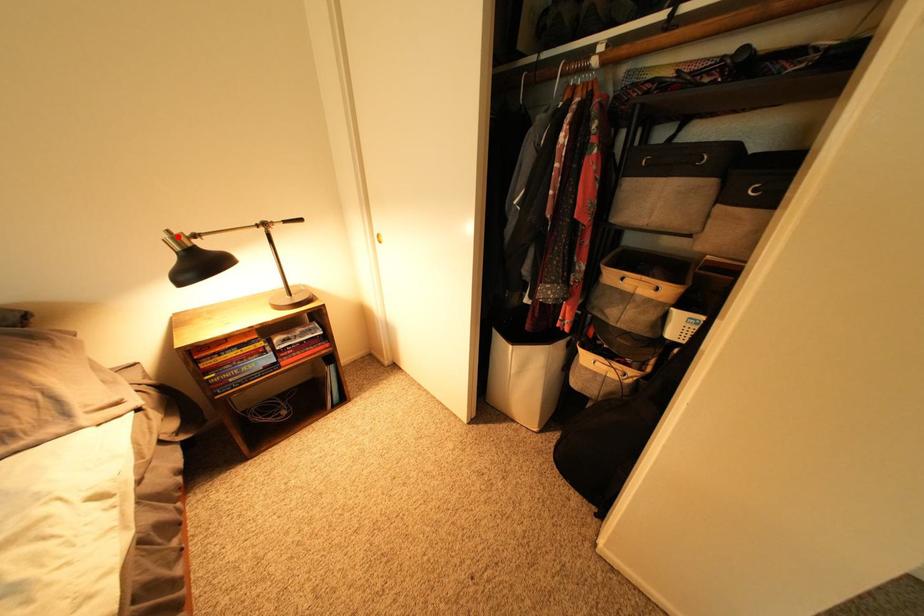
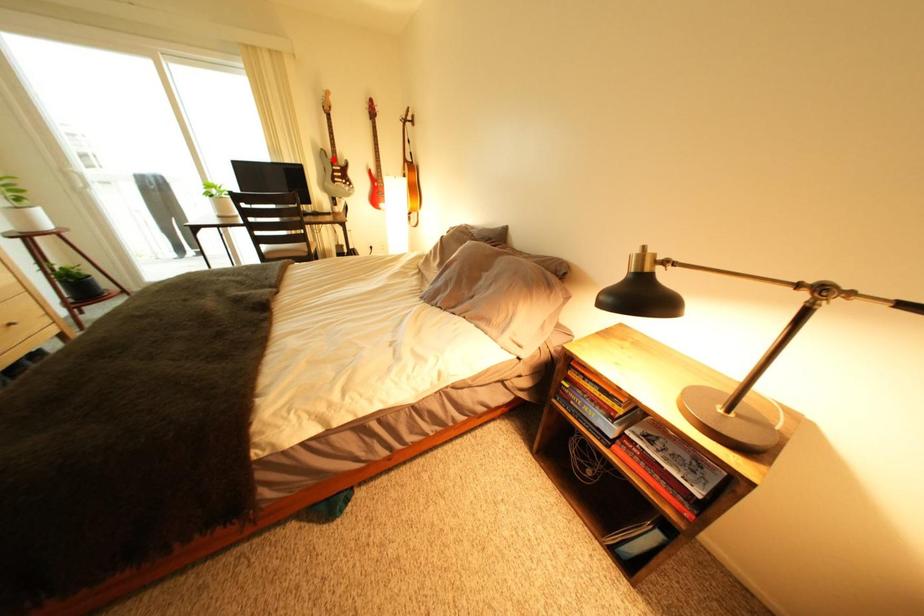
I am providing you with two images of the same scene from different viewpoints. A red point is marked on the first image and another point is marked on the second image. Is the red point in image1 aligned with the point shown in image2?

No